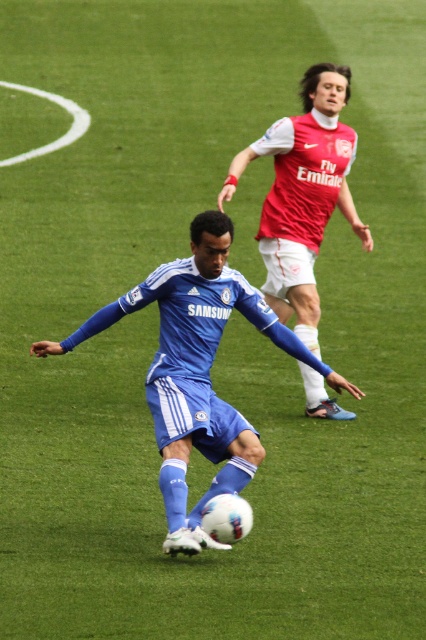
Question: Does matte blue uniform at center have a lesser width compared to red jersey at upper right?

Choices:
 (A) yes
 (B) no

Answer: (B)

Question: Observing the image, what is the correct spatial positioning of matte blue uniform at center in reference to red jersey at upper right?

Choices:
 (A) above
 (B) below

Answer: (B)

Question: Which point is farther to the camera?

Choices:
 (A) (310, 317)
 (B) (204, 372)

Answer: (A)

Question: Observing the image, what is the correct spatial positioning of matte blue uniform at center in reference to red jersey at upper right?

Choices:
 (A) above
 (B) below

Answer: (B)